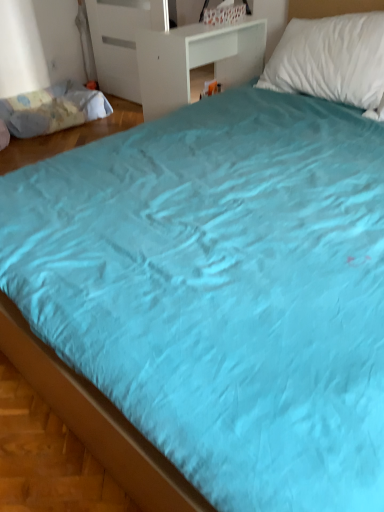
Question: Considering the relative positions of white matte table at upper center and light blue fabric mattress at left in the image provided, is white matte table at upper center to the right of light blue fabric mattress at left from the viewer's perspective?

Choices:
 (A) no
 (B) yes

Answer: (B)

Question: Does white matte table at upper center have a smaller size compared to light blue fabric mattress at left?

Choices:
 (A) no
 (B) yes

Answer: (A)

Question: Can you confirm if white matte table at upper center is thinner than light blue fabric mattress at left?

Choices:
 (A) yes
 (B) no

Answer: (A)

Question: Is there a large distance between white matte table at upper center and light blue fabric mattress at left?

Choices:
 (A) no
 (B) yes

Answer: (B)

Question: From a real-world perspective, is white matte table at upper center on top of light blue fabric mattress at left?

Choices:
 (A) no
 (B) yes

Answer: (B)

Question: From the image's perspective, would you say white matte table at upper center is shown under light blue fabric mattress at left?

Choices:
 (A) yes
 (B) no

Answer: (A)

Question: Is light blue fabric mattress at left far away from white matte table at upper center?

Choices:
 (A) yes
 (B) no

Answer: (A)

Question: Are light blue fabric mattress at left and white matte table at upper center beside each other?

Choices:
 (A) yes
 (B) no

Answer: (B)

Question: Is light blue fabric mattress at left at the right side of white matte table at upper center?

Choices:
 (A) yes
 (B) no

Answer: (B)

Question: From the image's perspective, would you say light blue fabric mattress at left is shown under white matte table at upper center?

Choices:
 (A) no
 (B) yes

Answer: (A)

Question: Is light blue fabric mattress at left oriented away from white matte table at upper center?

Choices:
 (A) yes
 (B) no

Answer: (B)

Question: Considering the relative positions of light blue fabric mattress at left and white matte table at upper center in the image provided, is light blue fabric mattress at left to the left of white matte table at upper center from the viewer's perspective?

Choices:
 (A) yes
 (B) no

Answer: (A)

Question: Looking at their shapes, would you say light blue fabric mattress at left is wider or thinner than white matte table at upper center?

Choices:
 (A) thin
 (B) wide

Answer: (B)